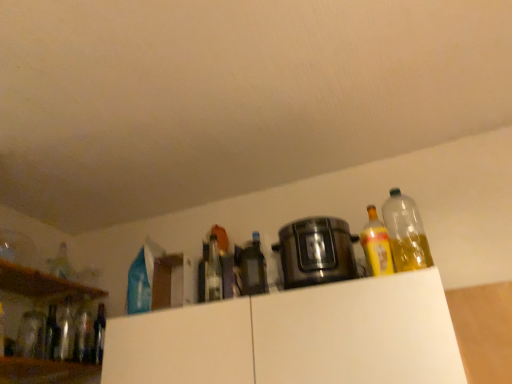
Where is `vacant space to the left of translucent glass bottle at center, placed as the fourth bottle when sorted from left to right`? Image resolution: width=512 pixels, height=384 pixels. vacant space to the left of translucent glass bottle at center, placed as the fourth bottle when sorted from left to right is located at coordinates click(x=47, y=361).